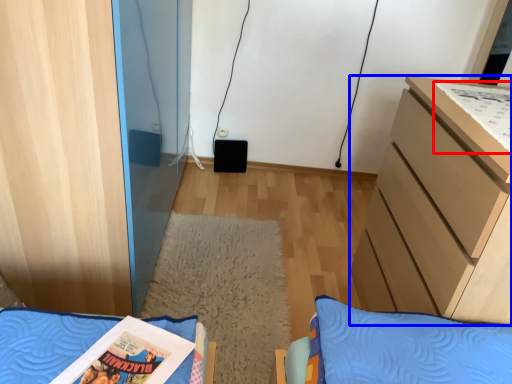
Question: Which point is further to the camera, comic book (highlighted by a red box) or chest of drawers (highlighted by a blue box)?

Choices:
 (A) comic book
 (B) chest of drawers

Answer: (A)